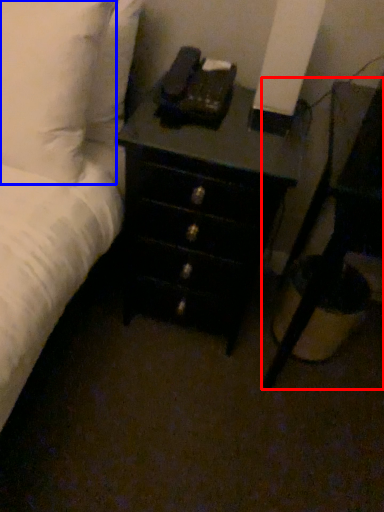
Question: Which point is further to the camera, nightstand (highlighted by a red box) or pillow (highlighted by a blue box)?

Choices:
 (A) nightstand
 (B) pillow

Answer: (B)